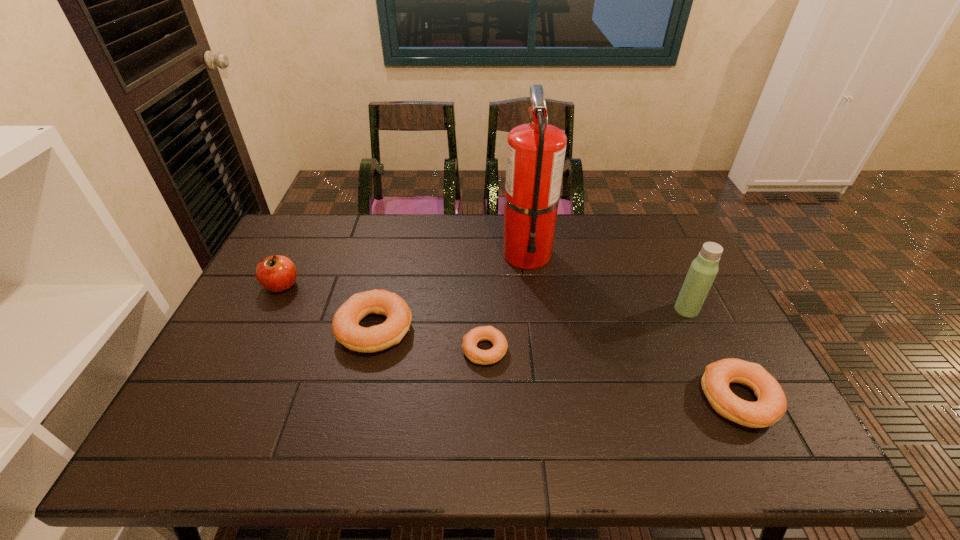
Image resolution: width=960 pixels, height=540 pixels. What are the coordinates of `free area in between the third object from left to right and the leftmost bagel` in the screenshot? It's located at (430, 339).

This screenshot has width=960, height=540. In order to click on free spot between the shortest bagel and the fifth tallest object in this screenshot , I will do `click(612, 375)`.

Find the location of `blank region between the leftmost object and the third object from right to left`. blank region between the leftmost object and the third object from right to left is located at coordinates (404, 269).

At what (x,y) coordinates should I click in order to perform the action: click on vacant point located between the third tallest object and the leftmost bagel. Please return your answer as a coordinate pair (x, y). The image size is (960, 540). Looking at the image, I should click on (328, 307).

At what (x,y) coordinates should I click in order to perform the action: click on free space that is in between the apple and the leftmost bagel. Please return your answer as a coordinate pair (x, y). The width and height of the screenshot is (960, 540). Looking at the image, I should click on (328, 307).

This screenshot has height=540, width=960. I want to click on free space between the leftmost object and the fire extinguisher, so click(x=404, y=269).

Locate an element on the screen. free space between the shortest object and the third tallest object is located at coordinates (383, 318).

I want to click on vacant area that lies between the rightmost bagel and the shortest bagel, so click(x=612, y=375).

The height and width of the screenshot is (540, 960). Identify the location of the fifth closest object to the thermos bottle. (277, 273).

Point out which object is positioned as the third nearest to the second bagel from right to left. Please provide its 2D coordinates. Your answer should be formatted as a tuple, i.e. [(x, y)], where the tuple contains the x and y coordinates of a point satisfying the conditions above.

[(771, 405)]